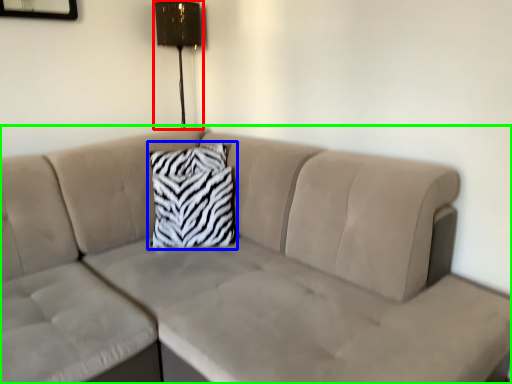
Question: Which is nearer to the lamp (highlighted by a red box)? pillow (highlighted by a blue box) or studio couch (highlighted by a green box).

Choices:
 (A) pillow
 (B) studio couch

Answer: (A)